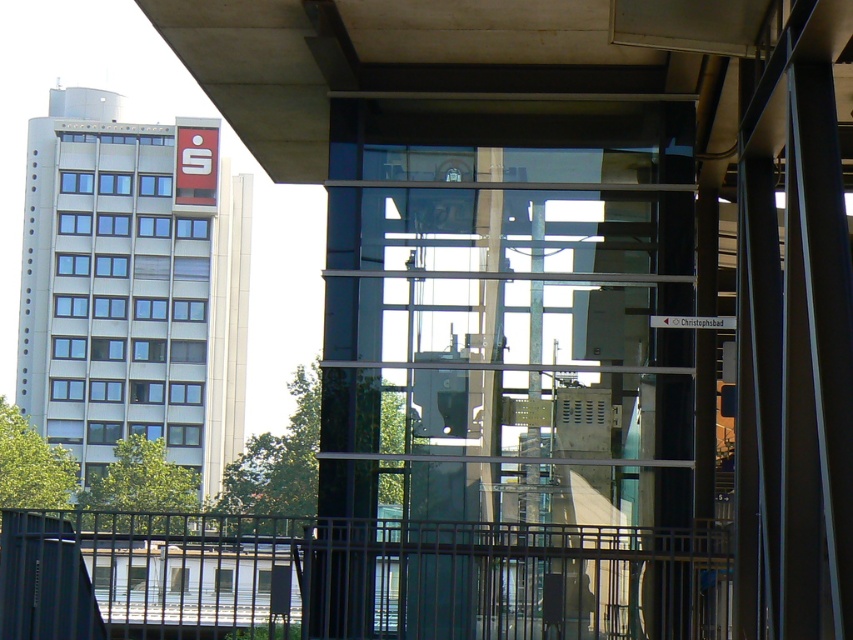
Question: Is transparent glass elevator at center smaller than concrete ceiling at upper center?

Choices:
 (A) no
 (B) yes

Answer: (A)

Question: Among these points, which one is nearest to the camera?

Choices:
 (A) (410, 595)
 (B) (689, 56)
 (C) (126, 580)

Answer: (B)

Question: Does transparent glass elevator at center have a smaller size compared to metallic gray rail at lower center?

Choices:
 (A) yes
 (B) no

Answer: (A)

Question: Among these points, which one is nearest to the camera?

Choices:
 (A) (567, 225)
 (B) (184, 32)

Answer: (B)

Question: Does transparent glass elevator at center appear on the right side of concrete ceiling at upper center?

Choices:
 (A) yes
 (B) no

Answer: (B)

Question: Estimate the real-world distances between objects in this image. Which object is closer to the metallic gray rail at lower center?

Choices:
 (A) concrete ceiling at upper center
 (B) transparent glass elevator at center

Answer: (B)